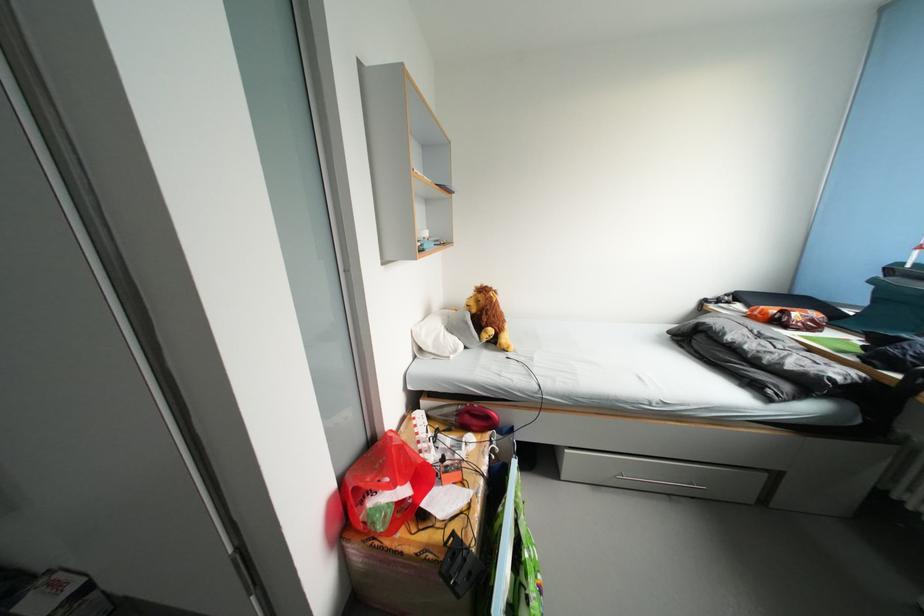
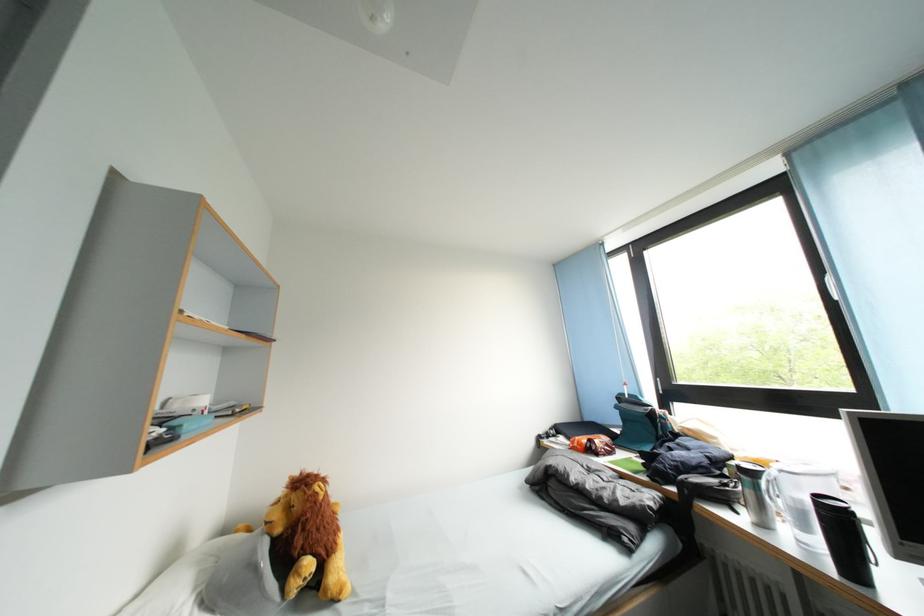
Where in the second image is the point corresponding to (786,326) from the first image?

(600, 455)